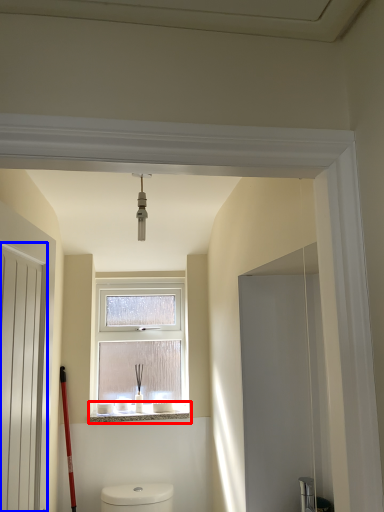
Question: Which point is further to the camera, window sill (highlighted by a red box) or screen door (highlighted by a blue box)?

Choices:
 (A) window sill
 (B) screen door

Answer: (A)